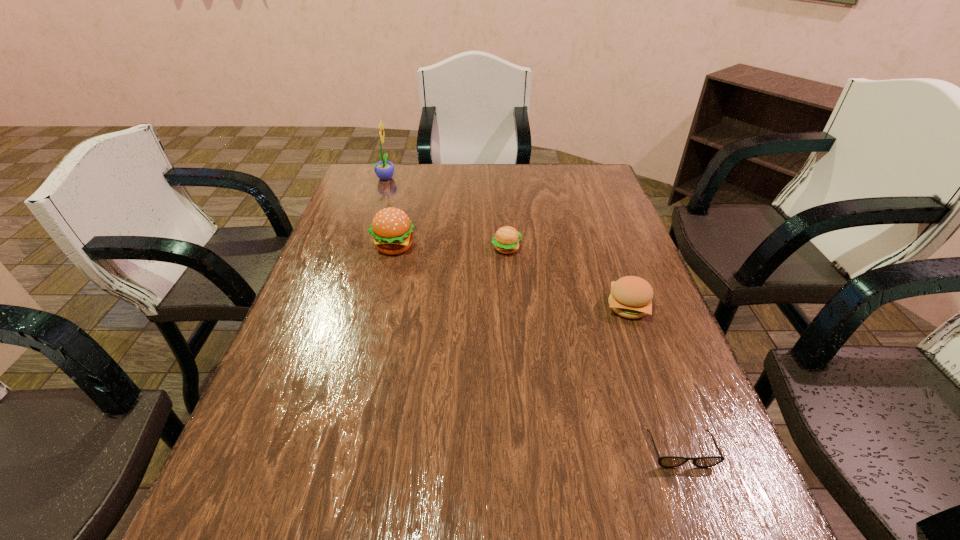
This screenshot has height=540, width=960. I want to click on blank space located on the front-facing side of the farthest object, so click(x=465, y=178).

You are a GUI agent. You are given a task and a screenshot of the screen. Output one action in this format:
    pyautogui.click(x=<x>, y=<y>)
    Task: Click on the vacant space located 0.050m on the right of the fourth shortest object
    This screenshot has width=960, height=540.
    Given the screenshot: What is the action you would take?
    pyautogui.click(x=433, y=246)

The width and height of the screenshot is (960, 540). Find the location of `vacant point located on the front of the third shortest object`. vacant point located on the front of the third shortest object is located at coordinates (659, 392).

Locate an element on the screen. The width and height of the screenshot is (960, 540). free space located on the back of the second hamburger from left to right is located at coordinates (504, 210).

The height and width of the screenshot is (540, 960). What are the coordinates of `vacant point located 0.080m on the front-facing side of the nearest object` in the screenshot? It's located at (704, 515).

The height and width of the screenshot is (540, 960). I want to click on object at the far edge, so click(384, 170).

You are a GUI agent. You are given a task and a screenshot of the screen. Output one action in this format:
    pyautogui.click(x=<x>, y=<y>)
    Task: Click on the sunflower at the left edge
    This screenshot has width=960, height=540.
    Given the screenshot: What is the action you would take?
    pyautogui.click(x=384, y=170)

Locate an element on the screen. This screenshot has height=540, width=960. hamburger that is positioned at the left edge is located at coordinates (391, 228).

You are a GUI agent. You are given a task and a screenshot of the screen. Output one action in this format:
    pyautogui.click(x=<x>, y=<y>)
    Task: Click on the hamburger present at the right edge
    Image resolution: width=960 pixels, height=540 pixels.
    Given the screenshot: What is the action you would take?
    pyautogui.click(x=631, y=297)

I want to click on sunglasses present at the right edge, so click(x=666, y=461).